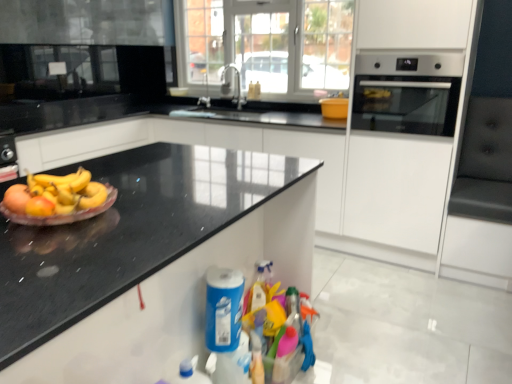
I want to click on free space to the left of silver metallic faucet at upper center, so click(188, 104).